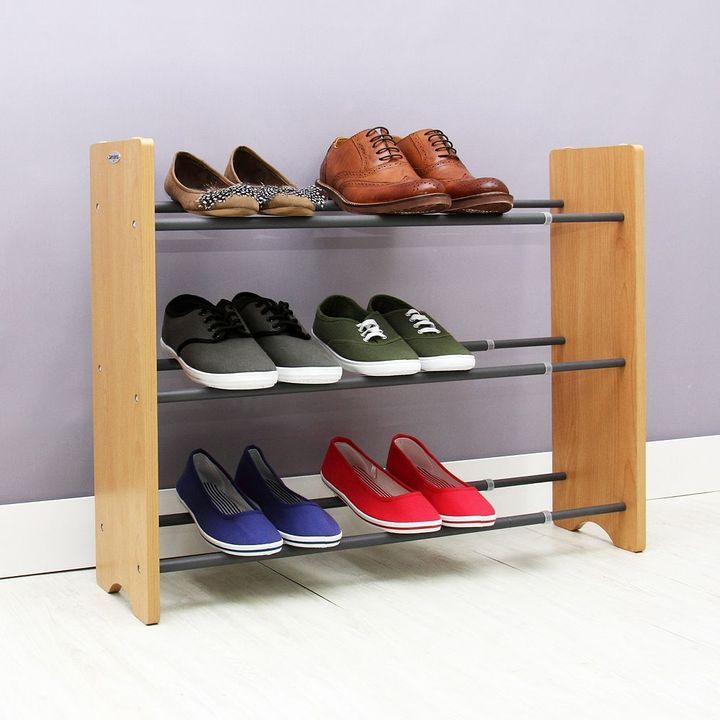
This screenshot has height=720, width=720. Identify the location of shoes on top rack. (215, 199), (255, 174), (366, 180), (481, 181).